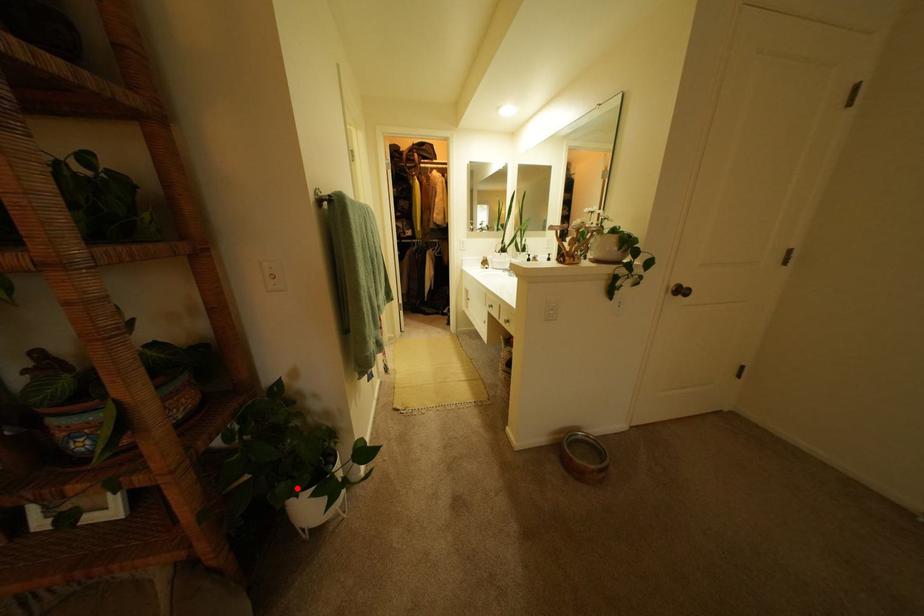
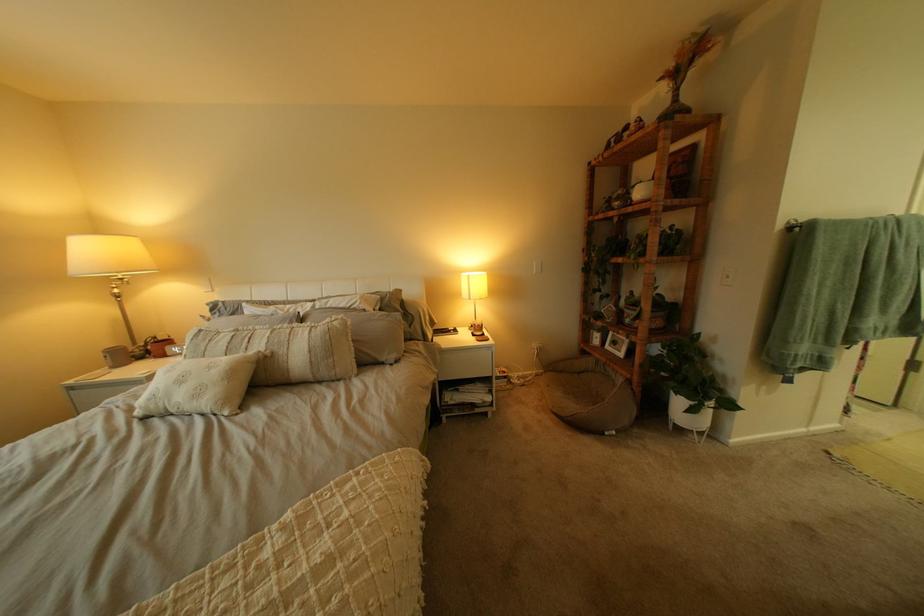
Find the pixel in the second image that matches the highlighted location in the first image.

(687, 385)